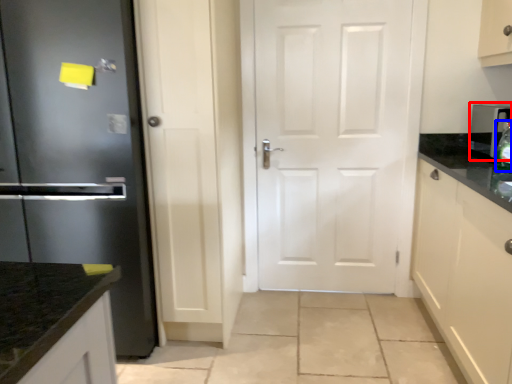
Question: Which of the following is the farthest to the observer, appliance (highlighted by a red box) or bottle (highlighted by a blue box)?

Choices:
 (A) appliance
 (B) bottle

Answer: (A)